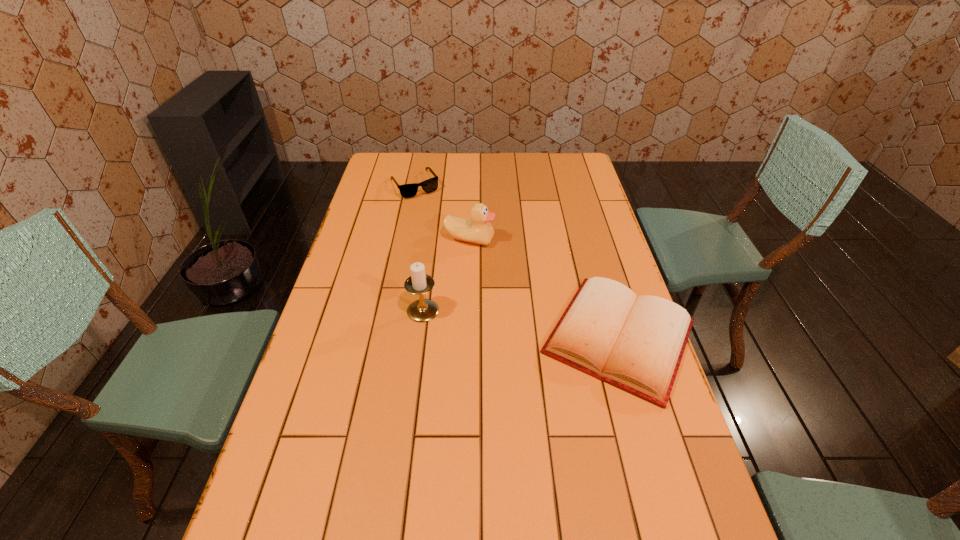
At what (x,y) coordinates should I click in order to perform the action: click on vacant space that satisfies the following two spatial constraints: 1. on the back side of the candle holder; 2. on the left side of the third shortest object. Please return your answer as a coordinate pair (x, y). This screenshot has height=540, width=960. Looking at the image, I should click on (432, 240).